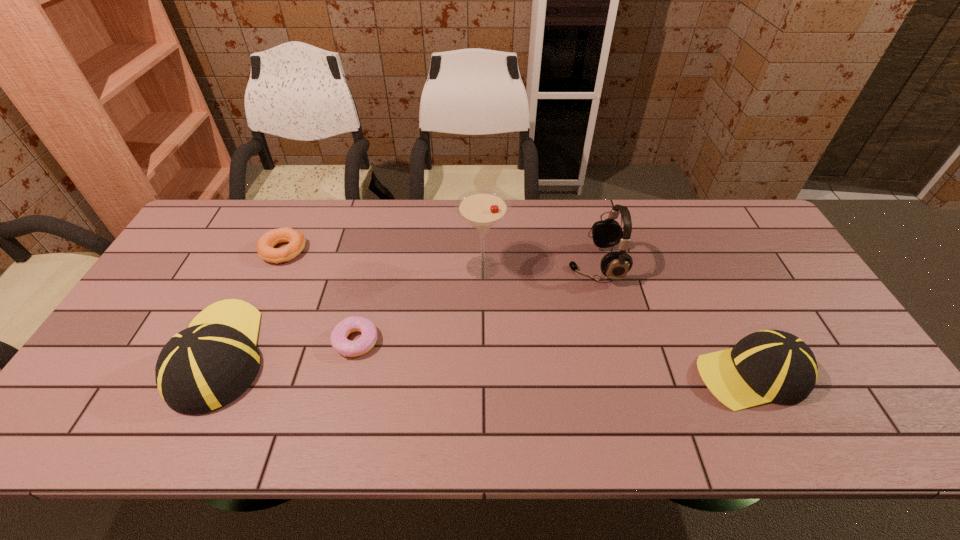
I want to click on free space located 0.280m on the left of the fourth object from right to left, so click(226, 341).

This screenshot has width=960, height=540. I want to click on bagel located in the far edge section of the desktop, so click(265, 244).

At what (x,y) coordinates should I click in order to perform the action: click on headset positioned at the far edge. Please return your answer as a coordinate pair (x, y). Image resolution: width=960 pixels, height=540 pixels. Looking at the image, I should click on (606, 233).

Where is `object located at the left edge`? The image size is (960, 540). object located at the left edge is located at coordinates (208, 365).

Locate an element on the screen. object that is at the right edge is located at coordinates (766, 366).

Where is `object present at the near left corner`? object present at the near left corner is located at coordinates (208, 365).

You are a GUI agent. You are given a task and a screenshot of the screen. Output one action in this format:
    pyautogui.click(x=<x>, y=<y>)
    Task: Click on the object that is at the near right corner
    This screenshot has width=960, height=540.
    Given the screenshot: What is the action you would take?
    pyautogui.click(x=766, y=366)

The width and height of the screenshot is (960, 540). I want to click on vacant region at the far edge of the desktop, so click(560, 232).

Where is `free location at the left edge`? This screenshot has height=540, width=960. free location at the left edge is located at coordinates (149, 308).

Find the location of a particular element. free space at the right edge is located at coordinates (768, 274).